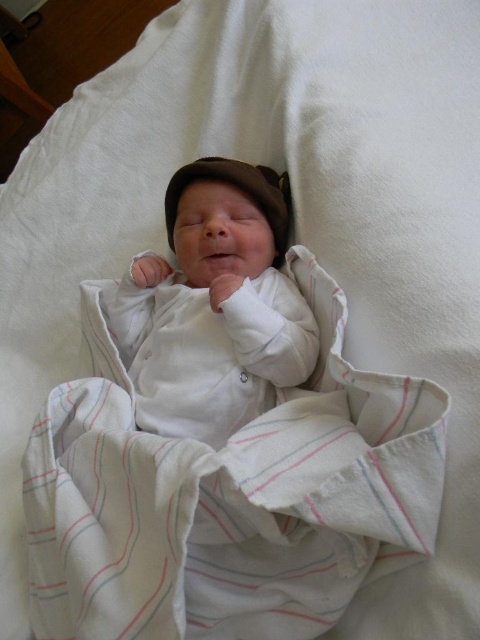
Can you confirm if white soft fabric newborn at center is positioned to the right of brown fabric hat at center?

No, white soft fabric newborn at center is not to the right of brown fabric hat at center.

Does white soft fabric newborn at center appear under brown fabric hat at center?

Yes.

I want to click on white soft fabric newborn at center, so click(x=215, y=307).